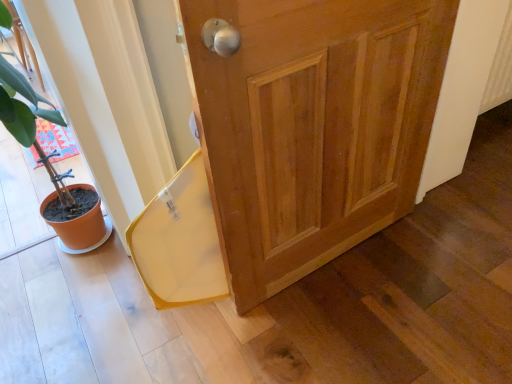
At what (x,y) coordinates should I click in order to perform the action: click on free spot in front of matte orange pot at left. Please return your answer as a coordinate pair (x, y). Image resolution: width=512 pixels, height=384 pixels. Looking at the image, I should click on (61, 316).